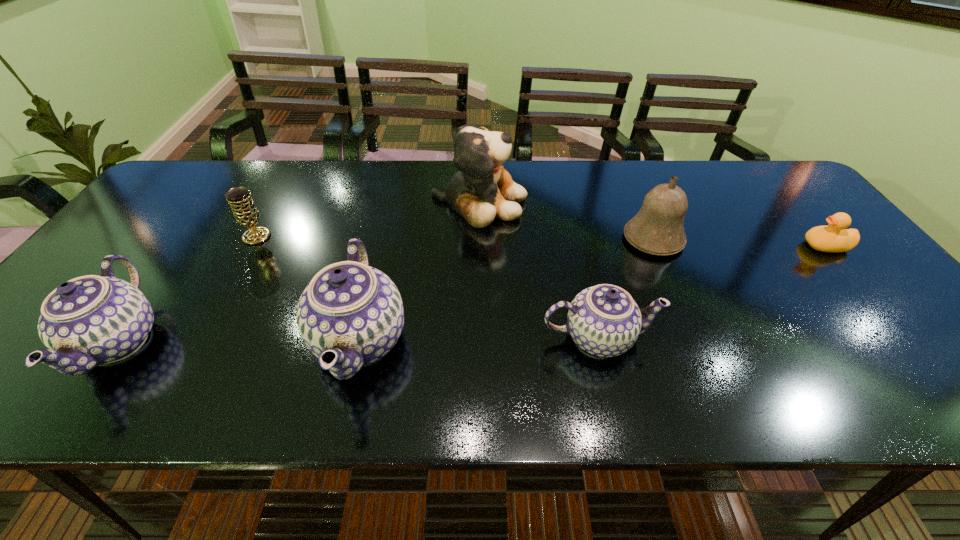
The width and height of the screenshot is (960, 540). Find the location of `free space between the puppy and the rightmost chinaware`. free space between the puppy and the rightmost chinaware is located at coordinates (539, 270).

Find the location of a particular element. The width and height of the screenshot is (960, 540). free space between the second object from left to right and the puppy is located at coordinates (368, 219).

Identify the location of vacant point located between the rightmost chinaware and the chalice. (428, 287).

Locate an element on the screen. The image size is (960, 540). empty space that is in between the puppy and the second shortest chinaware is located at coordinates (299, 272).

Locate an element on the screen. free spot between the bell and the rightmost chinaware is located at coordinates (626, 289).

Locate an element on the screen. This screenshot has height=540, width=960. object that can be found as the second closest to the second chinaware from left to right is located at coordinates (244, 209).

Identify the location of object that is the closest to the sixth object from right to left. (87, 321).

Select which chinaware appears as the second closest to the duck. Please provide its 2D coordinates. Your answer should be formatted as a tuple, i.e. [(x, y)], where the tuple contains the x and y coordinates of a point satisfying the conditions above.

[(349, 308)]

Select which chinaware appears as the closest to the second chinaware from left to right. Please provide its 2D coordinates. Your answer should be formatted as a tuple, i.e. [(x, y)], where the tuple contains the x and y coordinates of a point satisfying the conditions above.

[(604, 320)]

At what (x,y) coordinates should I click in order to perform the action: click on vacant space that satisfies the following two spatial constraints: 1. at the face of the puppy; 2. on the left side of the second object from right to left. Please return your answer as a coordinate pair (x, y). Looking at the image, I should click on (479, 239).